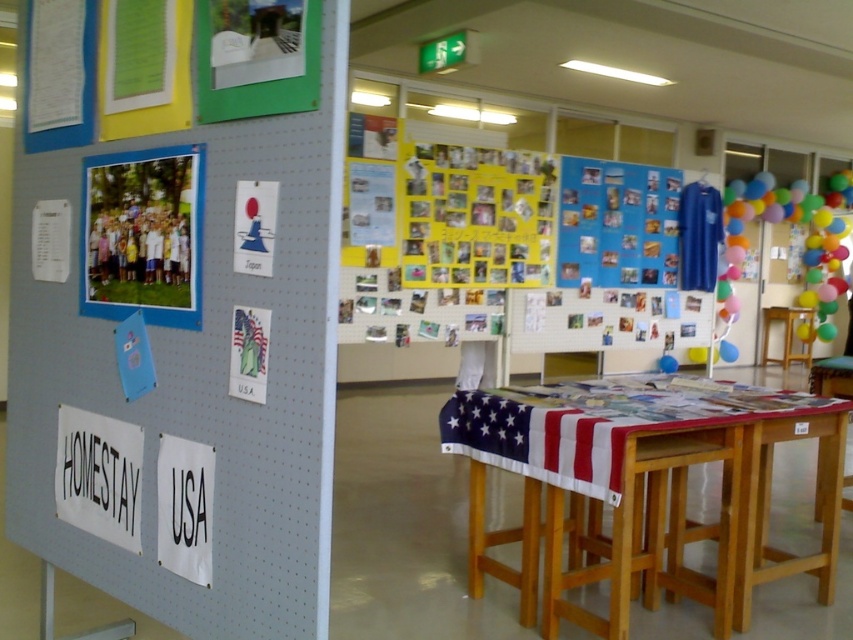
Question: Can you confirm if matte paper photo at left is positioned below matte paper poster at upper left?

Choices:
 (A) yes
 (B) no

Answer: (B)

Question: Which object appears farthest from the camera in this image?

Choices:
 (A) wooden chair at right
 (B) yellow paper at center
 (C) multicolored balloons at right
 (D) wooden table at center

Answer: (C)

Question: Can you confirm if multicolored balloons at right is positioned to the right of matte paper poster at upper left?

Choices:
 (A) yes
 (B) no

Answer: (A)

Question: Estimate the real-world distances between objects in this image. Which object is farther from the yellow paper at upper center?

Choices:
 (A) wooden chair at right
 (B) yellow paper at center

Answer: (A)

Question: Which of the following is the closest to the observer?

Choices:
 (A) (461, 417)
 (B) (115, 164)
 (C) (810, 321)
 (D) (271, 228)

Answer: (D)

Question: From the image, what is the correct spatial relationship of wooden table at center in relation to white paper at left?

Choices:
 (A) below
 (B) above

Answer: (A)